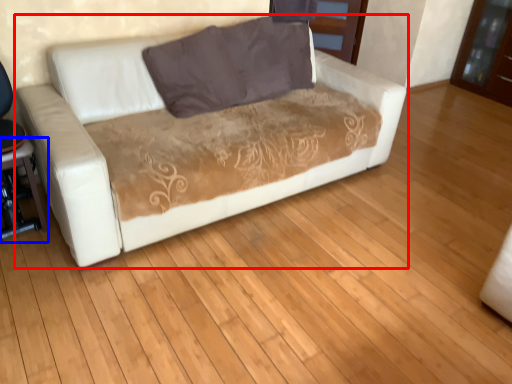
Question: Which object is further to the camera taking this photo, studio couch (highlighted by a red box) or table (highlighted by a blue box)?

Choices:
 (A) studio couch
 (B) table

Answer: (B)